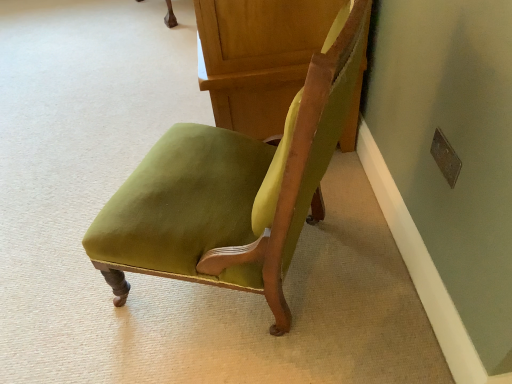
Find the location of a particular element. This screenshot has width=512, height=384. velvet green chair at center is located at coordinates (258, 57).

What do you see at coordinates (258, 57) in the screenshot?
I see `velvet green chair at center` at bounding box center [258, 57].

The width and height of the screenshot is (512, 384). What do you see at coordinates (232, 189) in the screenshot?
I see `velvet green chair at center` at bounding box center [232, 189].

Where is `velvet green chair at center`? velvet green chair at center is located at coordinates (232, 189).

Where is `velvet green chair at center`? velvet green chair at center is located at coordinates (258, 57).

Considering the positions of objects velvet green chair at center and velvet green chair at center in the image provided, who is more to the left, velvet green chair at center or velvet green chair at center?

velvet green chair at center.

Considering their positions, is velvet green chair at center located in front of or behind velvet green chair at center?

velvet green chair at center is positioned closer to the viewer than velvet green chair at center.

Is point (160, 190) positioned in front of point (295, 51)?

Yes, point (160, 190) is closer to viewer.

From the image's perspective, which is below, velvet green chair at center or velvet green chair at center?

velvet green chair at center, from the image's perspective.

Looking at this image, from a real-world perspective, is velvet green chair at center on velvet green chair at center?

Yes, from a real-world perspective, velvet green chair at center is over velvet green chair at center

Which object is thinner, velvet green chair at center or velvet green chair at center?

velvet green chair at center is thinner.

Can you confirm if velvet green chair at center is taller than velvet green chair at center?

Yes, velvet green chair at center is taller than velvet green chair at center.

Who is bigger, velvet green chair at center or velvet green chair at center?

velvet green chair at center.

Is velvet green chair at center completely or partially inside velvet green chair at center?

Definitely not — velvet green chair at center is not inside velvet green chair at center.

Is velvet green chair at center in contact with velvet green chair at center?

No, velvet green chair at center is not beside velvet green chair at center.

Does velvet green chair at center turn towards velvet green chair at center?

No, velvet green chair at center is not facing towards velvet green chair at center.

I want to click on furniture below the velvet green chair at center (from a real-world perspective), so click(x=258, y=57).

Consider the image. Can you confirm if velvet green chair at center is positioned to the left of velvet green chair at center?

In fact, velvet green chair at center is to the right of velvet green chair at center.

Is the depth of velvet green chair at center less than that of velvet green chair at center?

No.

Is point (219, 89) positioned in front of point (202, 241)?

That is False.

From the image's perspective, which one is positioned higher, velvet green chair at center or velvet green chair at center?

velvet green chair at center, from the image's perspective.

From a real-world perspective, is velvet green chair at center physically located above or below velvet green chair at center?

velvet green chair at center is situated lower than velvet green chair at center in the real world.

Considering the sizes of objects velvet green chair at center and velvet green chair at center in the image provided, who is wider, velvet green chair at center or velvet green chair at center?

With larger width is velvet green chair at center.

From the picture: From their relative heights in the image, would you say velvet green chair at center is taller or shorter than velvet green chair at center?

Considering their sizes, velvet green chair at center has less height than velvet green chair at center.

Between velvet green chair at center and velvet green chair at center, which one has larger size?

velvet green chair at center.

Would you say velvet green chair at center is outside velvet green chair at center?

Indeed, velvet green chair at center is completely outside velvet green chair at center.

Is velvet green chair at center not close to velvet green chair at center?

No, velvet green chair at center is not far away from velvet green chair at center.

Is velvet green chair at center aimed at velvet green chair at center?

No, velvet green chair at center is not oriented towards velvet green chair at center.

How different are the orientations of velvet green chair at center and velvet green chair at center in degrees?

The angle between the facing direction of velvet green chair at center and the facing direction of velvet green chair at center is 25.8 degrees.

In order to click on chair lying below the velvet green chair at center (from the image's perspective) in this screenshot , I will do `click(232, 189)`.

Where is `chair that is on the left side of velvet green chair at center`? The image size is (512, 384). chair that is on the left side of velvet green chair at center is located at coordinates (232, 189).

The image size is (512, 384). Find the location of `chair in front of the velvet green chair at center`. chair in front of the velvet green chair at center is located at coordinates (232, 189).